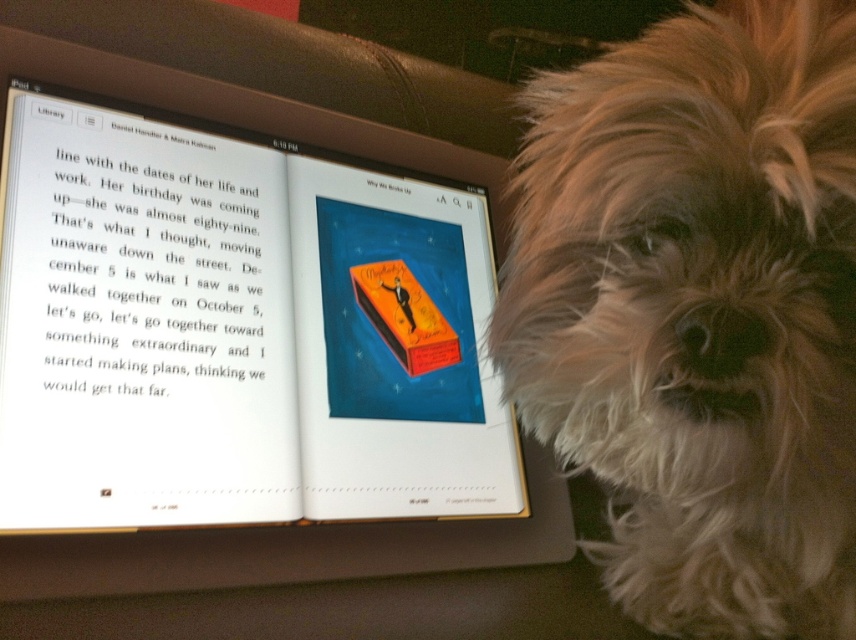
You are standing in front of the tablet screen with the open book and the dog. There are two points marked on the screen at coordinates point [426,404] and point [694,426]. If you were to draw a line from your current position to each point, which point would require the line to pass closer to the dog?

Point [426,404] is behind point [694,426], so the line to point [426,404] would pass closer to the dog.

You have a small box that can only fit items wider than the fluffy white fur at right. Can the matte orange book at center fit into the box?

The matte orange book at center has a width larger than the fluffy white fur at right, so it can fit into the box designed for items wider than the fluffy white fur at right.

You are a robotic arm that needs to pick up the matte orange book at center and place it near the fluffy white fur at right. Given the robotic arm has a maximum reach of 25 centimeters, can it successfully move the book without moving its base?

The distance between the matte orange book at center and the fluffy white fur at right is 25.22 centimeters. Since the robotic arm can only reach 25 centimeters, it cannot cover the required distance without moving its base.